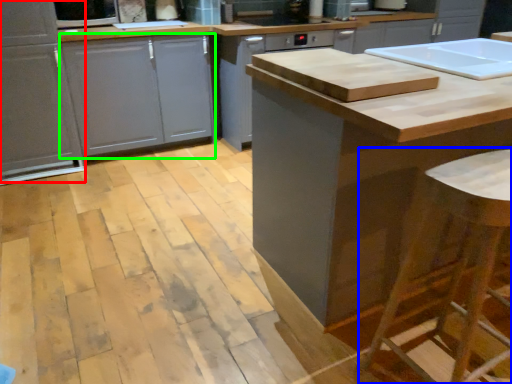
Question: Based on their relative distances, which object is nearer to cabinetry (highlighted by a red box)? Choose from bar stool (highlighted by a blue box) and drawer (highlighted by a green box).

Choices:
 (A) bar stool
 (B) drawer

Answer: (B)